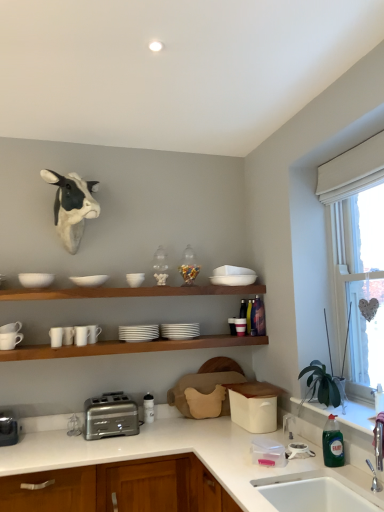
Locate an element on the screen. This screenshot has height=512, width=384. free space on the front side of white matte cups at left, positioned as the 6th tableware in right-to-left order is located at coordinates (57, 346).